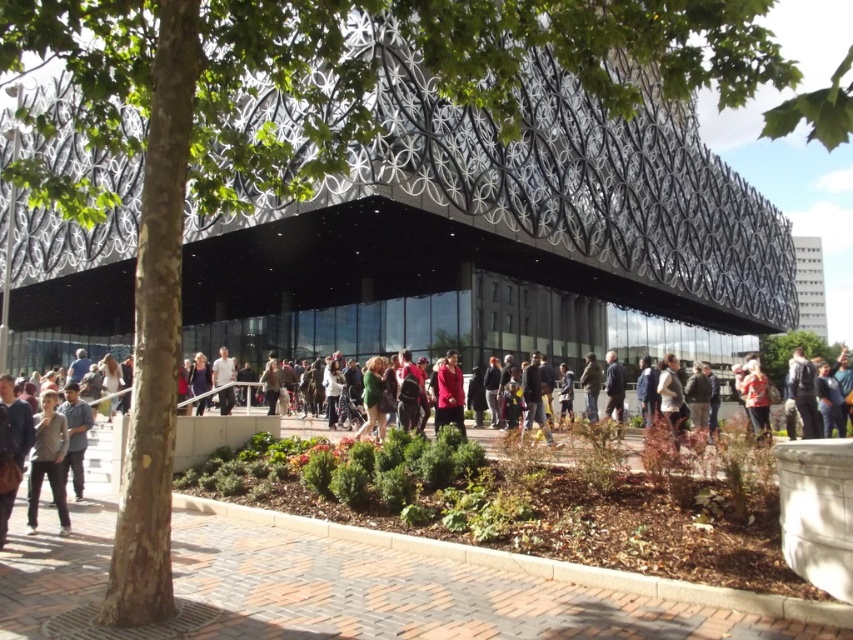
Measure the distance between point (445, 376) and camera.

Point (445, 376) and camera are 39.98 meters apart from each other.

Who is higher up, matte red coat at center or green fabric jacket at center?

matte red coat at center is higher up.

At what (x,y) coordinates should I click in order to perform the action: click on matte red coat at center. Please return your answer as a coordinate pair (x, y). This screenshot has height=640, width=853. Looking at the image, I should click on pos(450,394).

Is point (665, 403) closer to viewer compared to point (618, 378)?

Yes.

Does green fabric jacket at center have a lesser height compared to dark blue jacket at center?

Indeed, green fabric jacket at center has a lesser height compared to dark blue jacket at center.

At what (x,y) coordinates should I click in order to perform the action: click on green fabric jacket at center. Please return your answer as a coordinate pair (x, y). The width and height of the screenshot is (853, 640). Looking at the image, I should click on (672, 397).

Is light gray fabric shirt at center thinner than dark brown leather jacket at center?

In fact, light gray fabric shirt at center might be wider than dark brown leather jacket at center.

Which is behind, point (231, 364) or point (584, 387)?

Positioned behind is point (231, 364).

What do you see at coordinates (223, 369) in the screenshot? This screenshot has width=853, height=640. I see `light gray fabric shirt at center` at bounding box center [223, 369].

This screenshot has height=640, width=853. Identify the location of light gray fabric shirt at center. (223, 369).